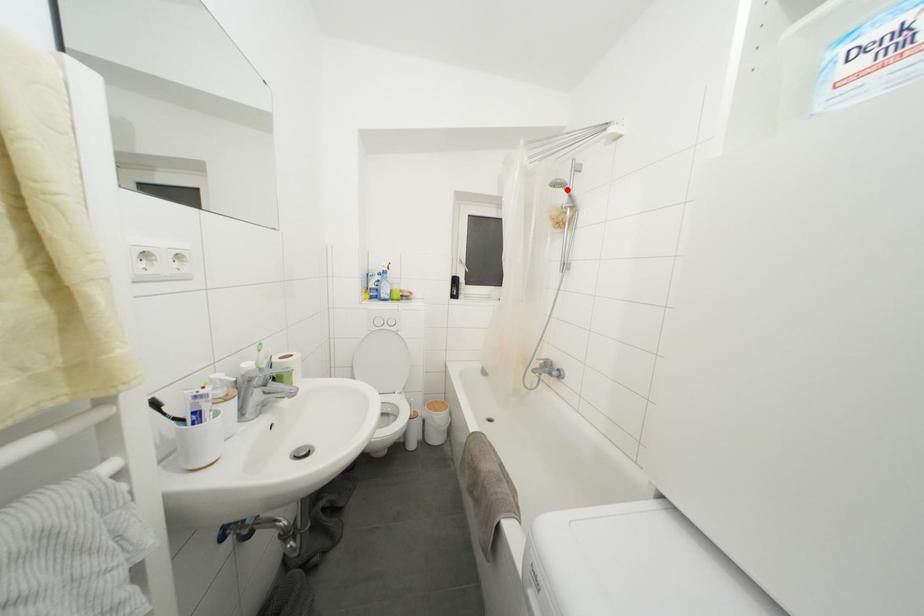
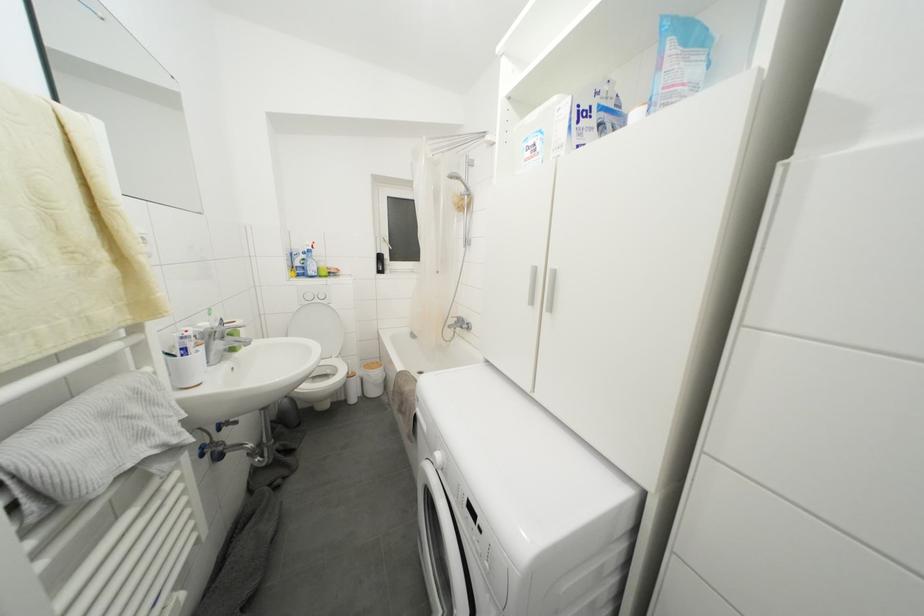
Where in the second image is the point corresponding to the highlighted location from the first image?

(463, 182)